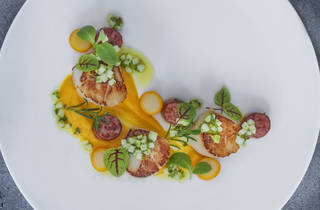
The image size is (320, 210). I want to click on plate, so click(x=278, y=48).